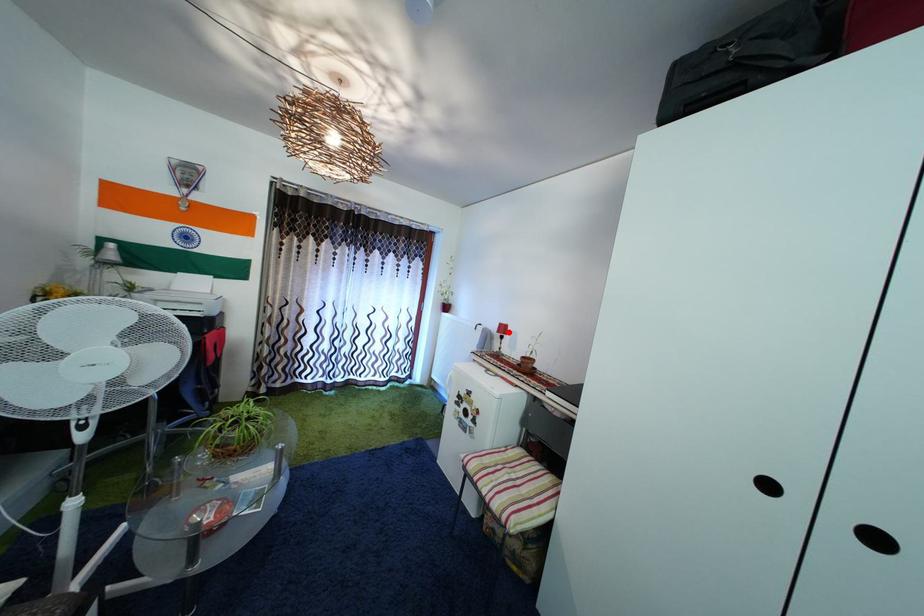
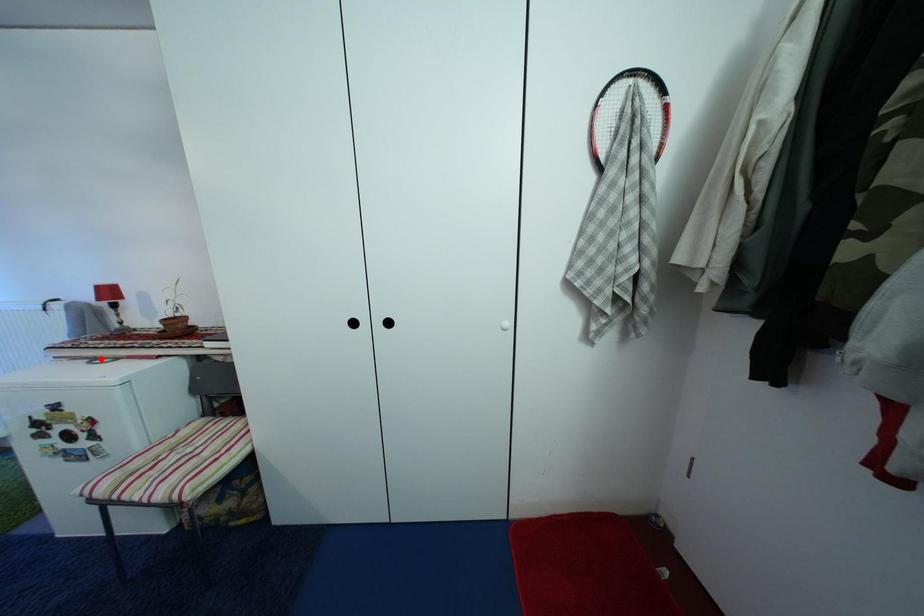
I am providing you with two images of the same scene from different viewpoints. A red point is marked on the first image and another point is marked on the second image. Do the highlighted points in image1 and image2 indicate the same real-world spot?

No